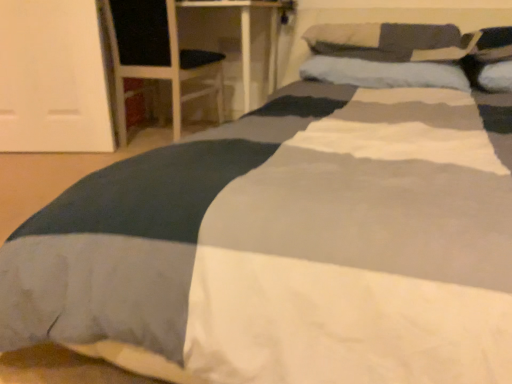
Question: Can soft blue pillow at center, which is counted as the second pillow, starting from the top, be found inside black fabric armchair at left?

Choices:
 (A) yes
 (B) no

Answer: (B)

Question: Is black fabric armchair at left to the right of soft blue pillow at center, which is counted as the second pillow, starting from the top, from the viewer's perspective?

Choices:
 (A) no
 (B) yes

Answer: (A)

Question: Could you tell me if black fabric armchair at left is turned towards soft blue pillow at center, which is the first pillow from bottom to top?

Choices:
 (A) yes
 (B) no

Answer: (B)

Question: From the image's perspective, is black fabric armchair at left below soft blue pillow at center, which is counted as the second pillow, starting from the top?

Choices:
 (A) yes
 (B) no

Answer: (B)

Question: From a real-world perspective, is black fabric armchair at left physically below soft blue pillow at center, which is the first pillow from bottom to top?

Choices:
 (A) yes
 (B) no

Answer: (A)

Question: Is soft blue pillow at center, which is counted as the second pillow, starting from the top, at the back of black fabric armchair at left?

Choices:
 (A) no
 (B) yes

Answer: (A)

Question: Can you confirm if soft blue pillow at center, which is counted as the second pillow, starting from the top, is positioned to the right of black fabric armchair at left?

Choices:
 (A) yes
 (B) no

Answer: (A)

Question: Considering the relative sizes of soft blue pillow at center, which is counted as the second pillow, starting from the top, and black fabric armchair at left in the image provided, is soft blue pillow at center, which is counted as the second pillow, starting from the top, wider than black fabric armchair at left?

Choices:
 (A) yes
 (B) no

Answer: (B)

Question: Does soft blue pillow at center, which is the first pillow from bottom to top, have a smaller size compared to black fabric armchair at left?

Choices:
 (A) no
 (B) yes

Answer: (B)

Question: Is soft blue pillow at center, which is counted as the second pillow, starting from the top, turned away from black fabric armchair at left?

Choices:
 (A) no
 (B) yes

Answer: (A)

Question: Is soft blue pillow at center, which is counted as the second pillow, starting from the top, aimed at black fabric armchair at left?

Choices:
 (A) yes
 (B) no

Answer: (B)

Question: Is black fabric armchair at left wider than soft gray pillow at upper right, which appears as the first pillow when viewed from the top?

Choices:
 (A) no
 (B) yes

Answer: (B)